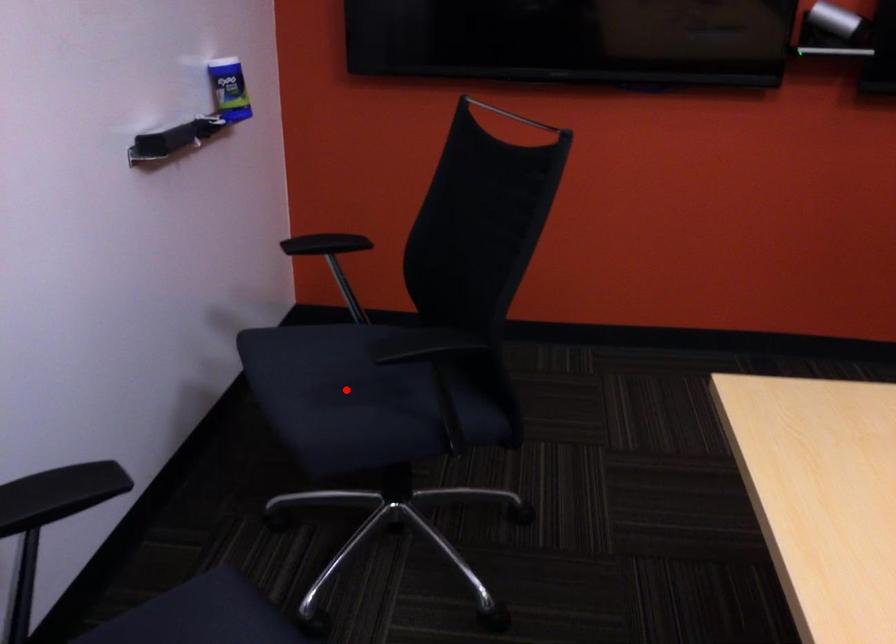
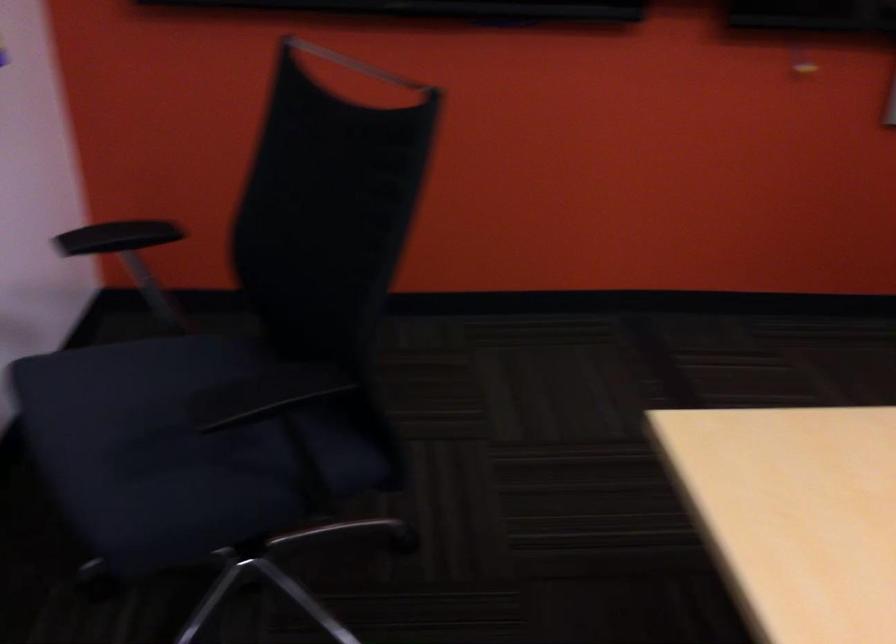
Question: I am providing you with two images of the same scene from different viewpoints. Image1 has a red point marked. In image2, the corresponding 3D location appears at what relative position? Reply with the corresponding letter.

Choices:
 (A) Closer
 (B) Farther

Answer: (A)